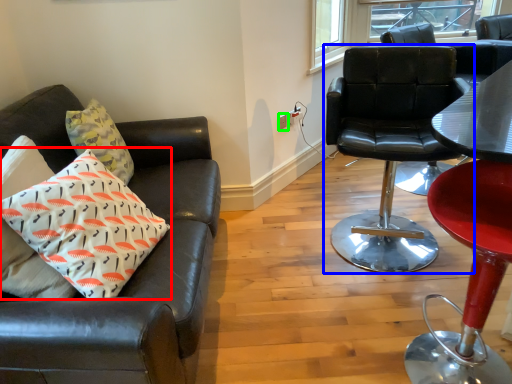
Question: Which object is the closest to the pillow (highlighted by a red box)? Choose among these: chair (highlighted by a blue box) or power outlet (highlighted by a green box).

Choices:
 (A) chair
 (B) power outlet

Answer: (A)